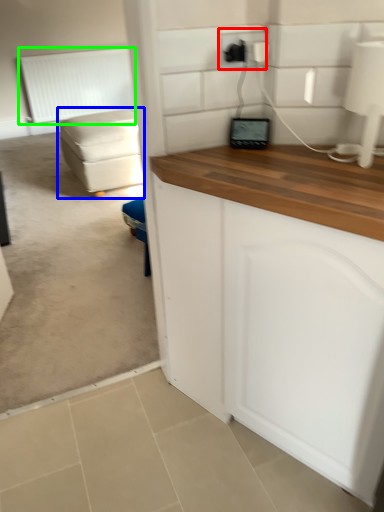
Question: Which object is positioned farthest from electric outlet (highlighted by a red box)? Select from studio couch (highlighted by a blue box) and radiator (highlighted by a green box).

Choices:
 (A) studio couch
 (B) radiator

Answer: (B)